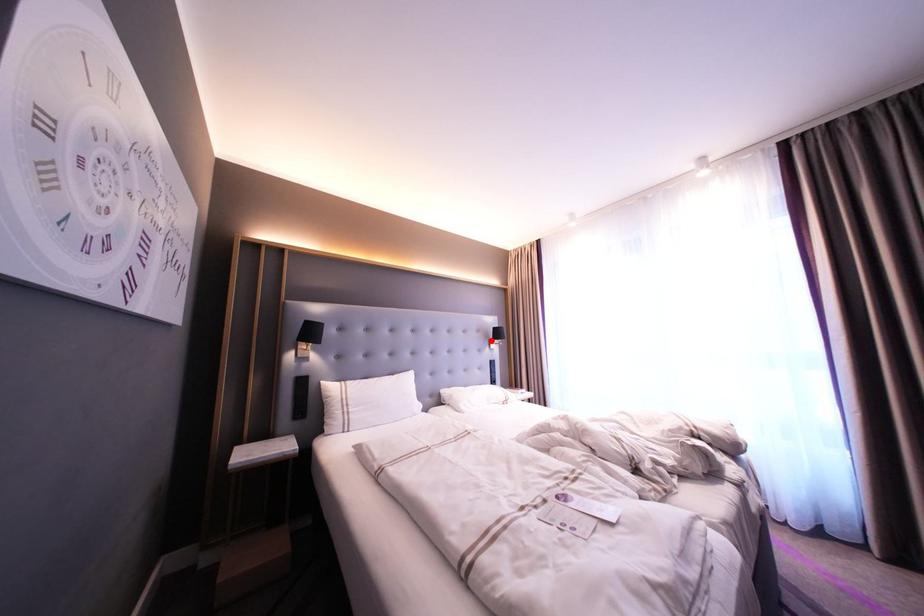
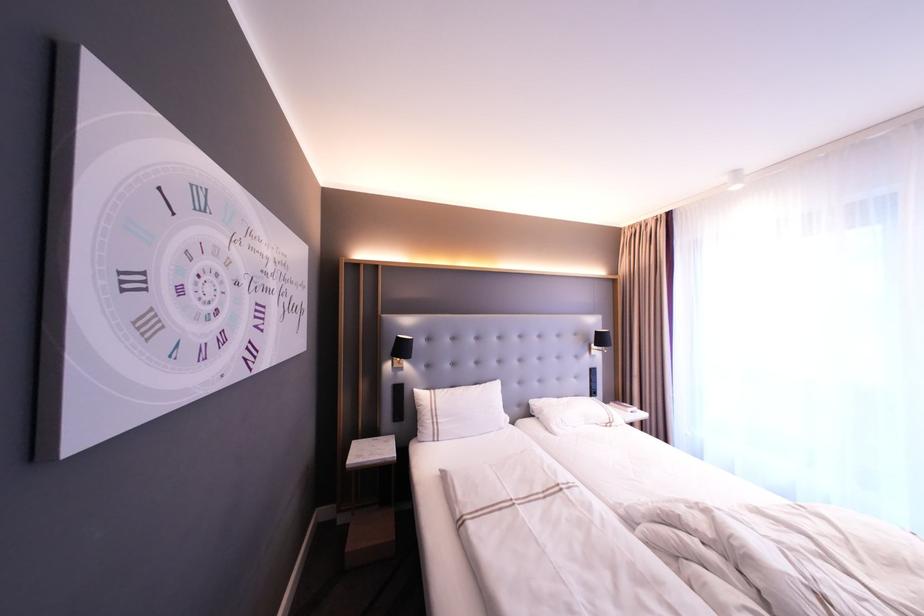
Locate, in the second image, the point that corresponds to the highlighted location in the first image.

(592, 346)